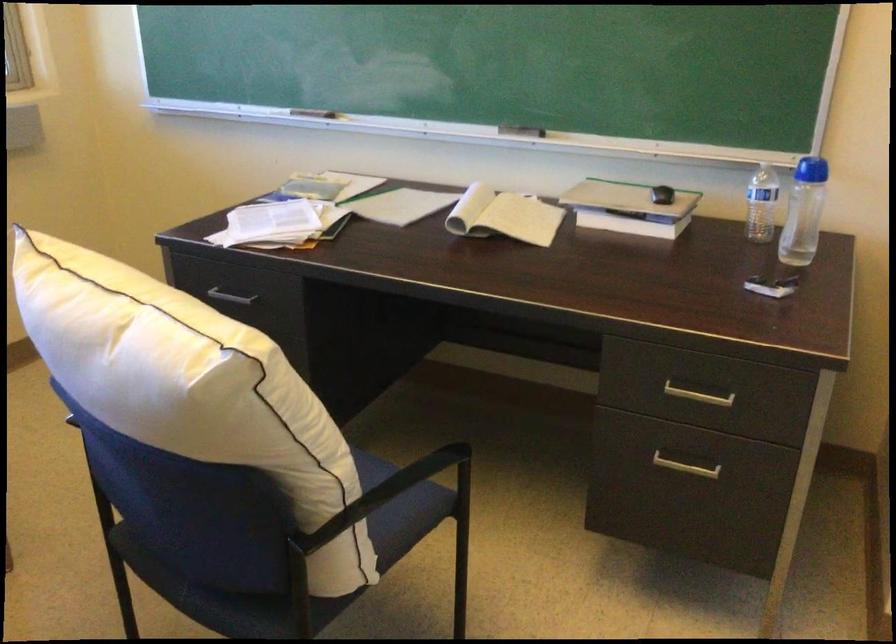
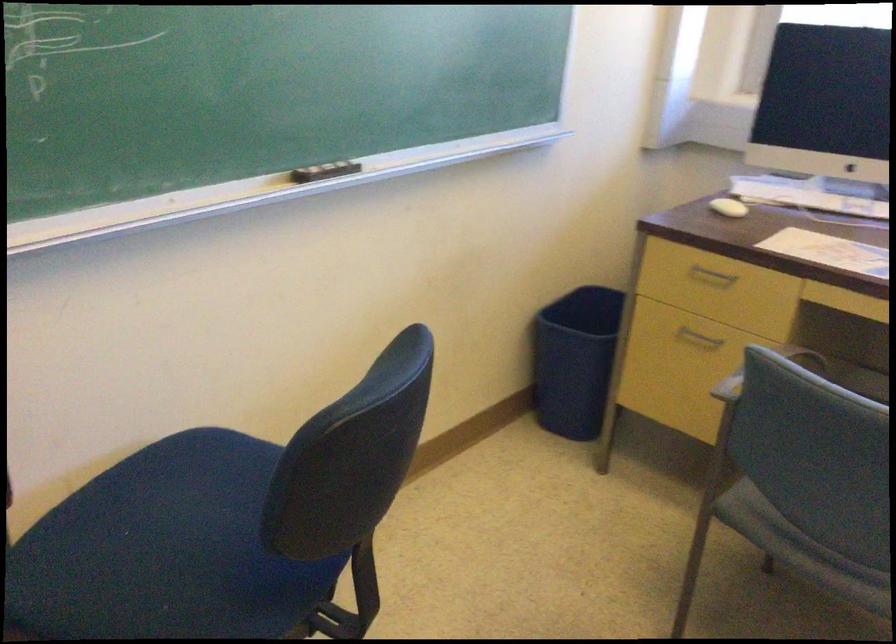
How did the camera likely rotate?

The rotation direction of the camera is left-down.